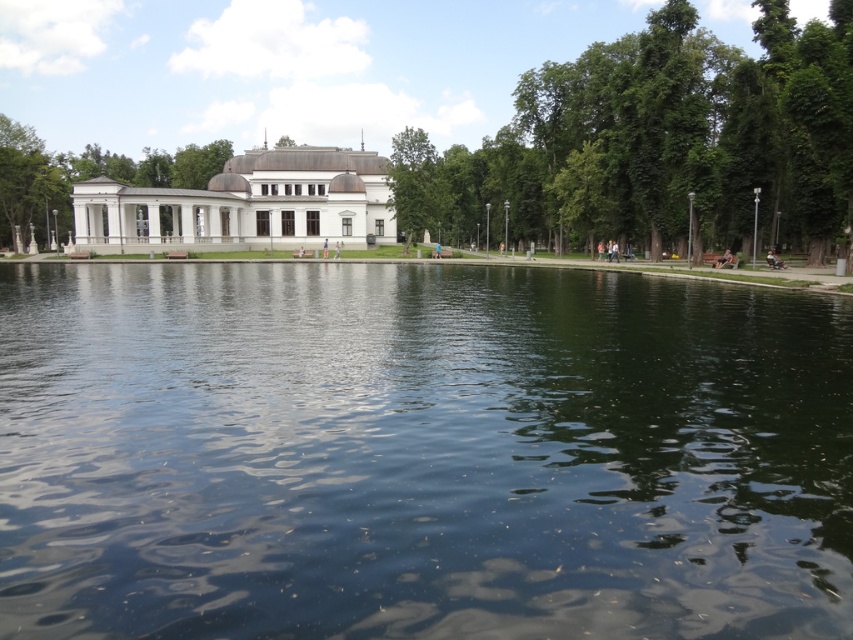
You are standing at the entrance of the park and want to reach the dark blue water at center. Based on the coordinates provided, in which direction should you walk to get there?

The dark blue water at center is located at coordinates point (419,454). Since the coordinates are given in the format x,y, where x represents the horizontal axis and y the vertical axis, you should walk towards the right side of the image to reach the dark blue water at center as its x coordinate is 0.711 which is to the right.

You are a visitor at the park and want to take a photo of the white glossy building at center and the dark blue water at center. Which object should you focus on first if you want to capture both in one frame?

The dark blue water at center is below the white glossy building at center, so you should focus on the white glossy building at center first to ensure both are in the same frame.

You are a park visitor who wants to take a photo of both the dark blue water at center and the green leafy tree at center. Which object should you focus on first if you want to capture both in a single frame without moving your camera?

You should focus on the green leafy tree at center first because it is taller than the dark blue water at center, allowing both to be in the frame more easily.